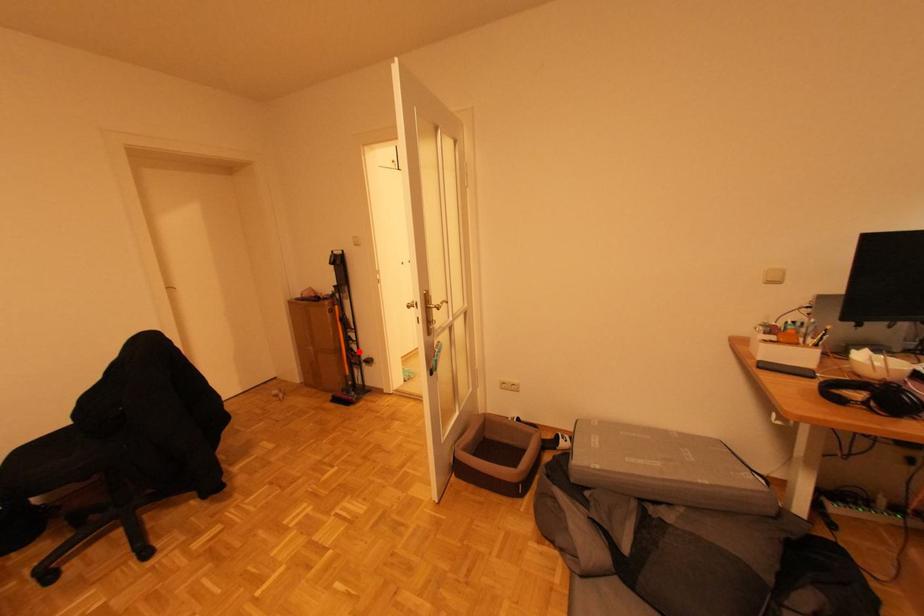
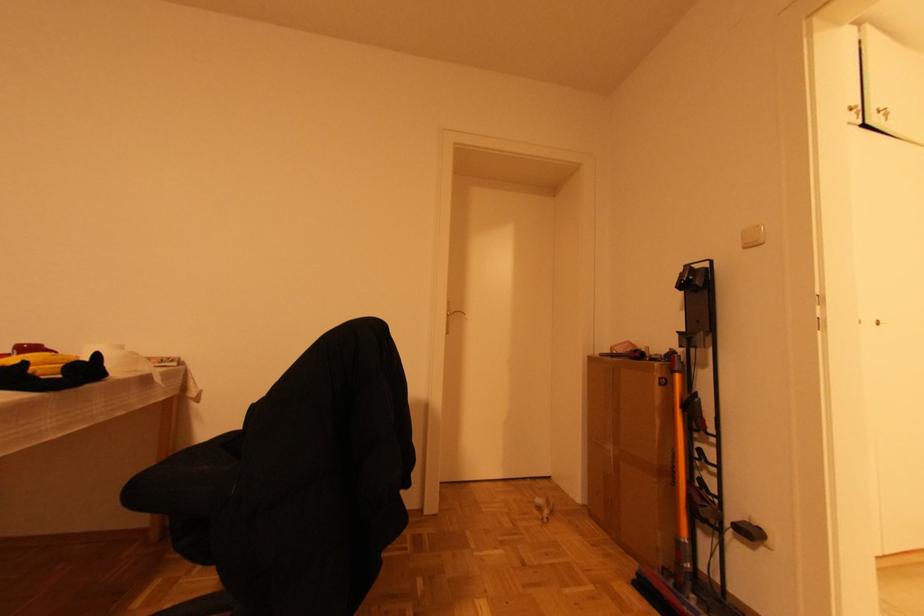
Question: I am providing you with two images of the same scene from different viewpoints. A red point is marked on the first image. At the location where the point appears in image 1, is it still visible in image 2?

Choices:
 (A) Yes
 (B) No

Answer: (A)